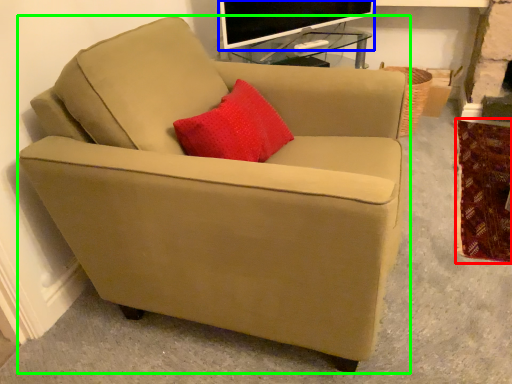
Question: Which is nearer to the blanket (highlighted by a red box)? television (highlighted by a blue box) or chair (highlighted by a green box).

Choices:
 (A) television
 (B) chair

Answer: (B)